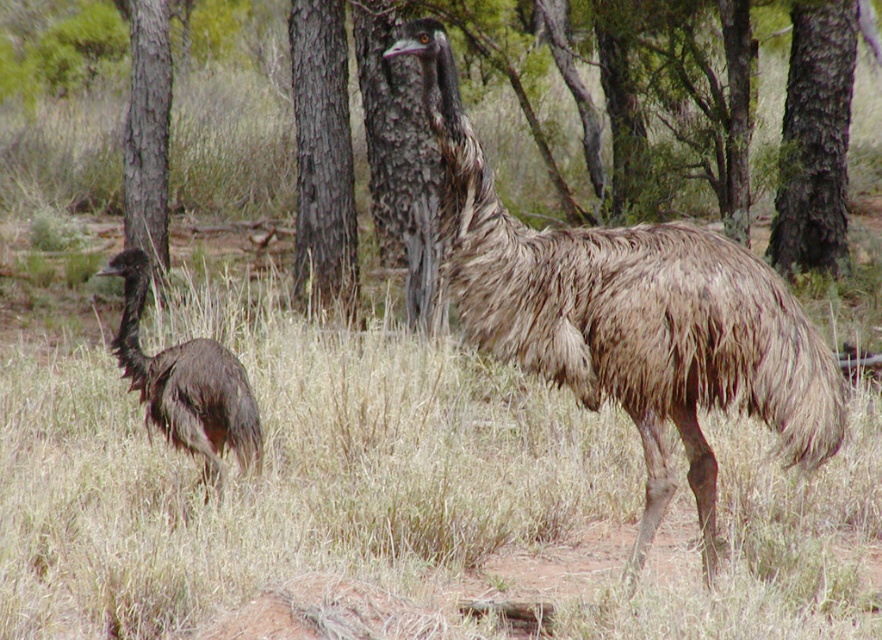
From the picture: You are a researcher studying the behavior of emus in their natural habitat. You have a GPS device that marks a specific point at coordinates (626, 314) in the image. Based on the scene description, can you identify which animal this point corresponds to?

The point at coordinates (626, 314) is on the brown textured ostrich at center.

You are a birdwatcher observing the scene from the front. You notice the brown rough bark tree at center and the brown feathered ostrich at left. Which object is positioned higher in the image?

The brown rough bark tree at center is positioned higher in the image than the brown feathered ostrich at left.